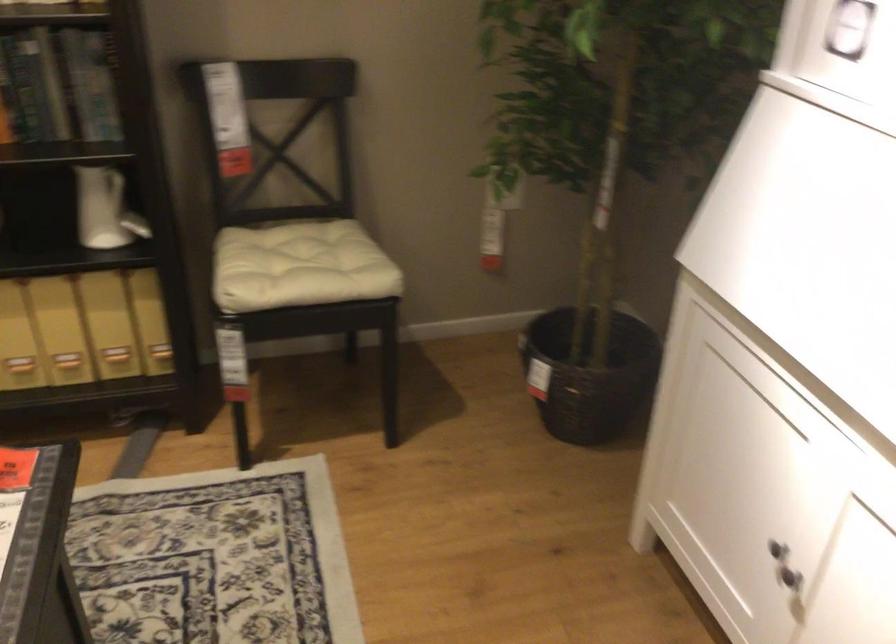
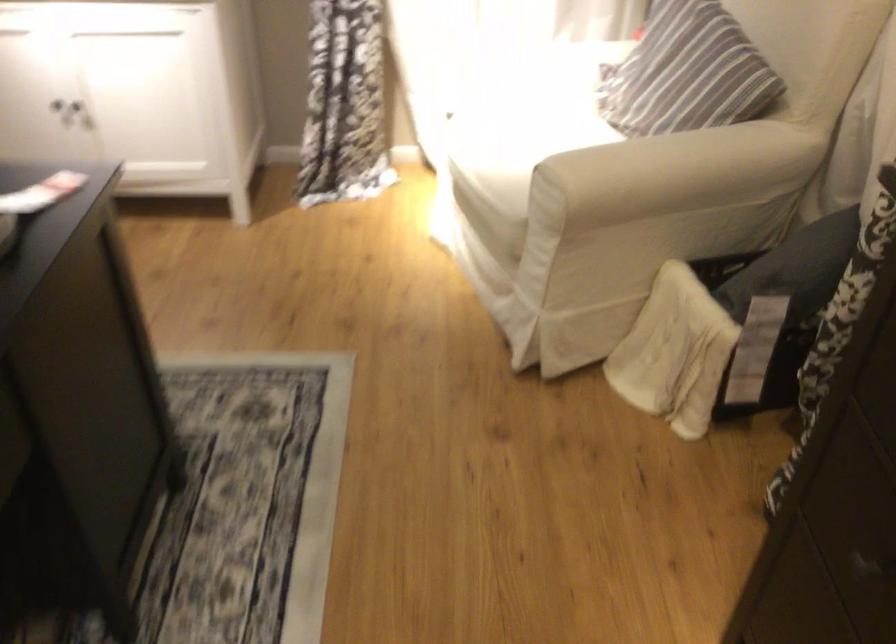
Find the pixel in the second image that matches the point at 788,549 in the first image.

(67, 108)